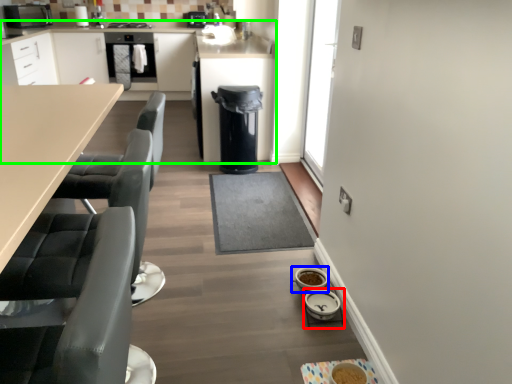
Question: Which is farther away from appliance (highlighted by a red box)? appliance (highlighted by a blue box) or cabinetry (highlighted by a green box)?

Choices:
 (A) appliance
 (B) cabinetry

Answer: (B)